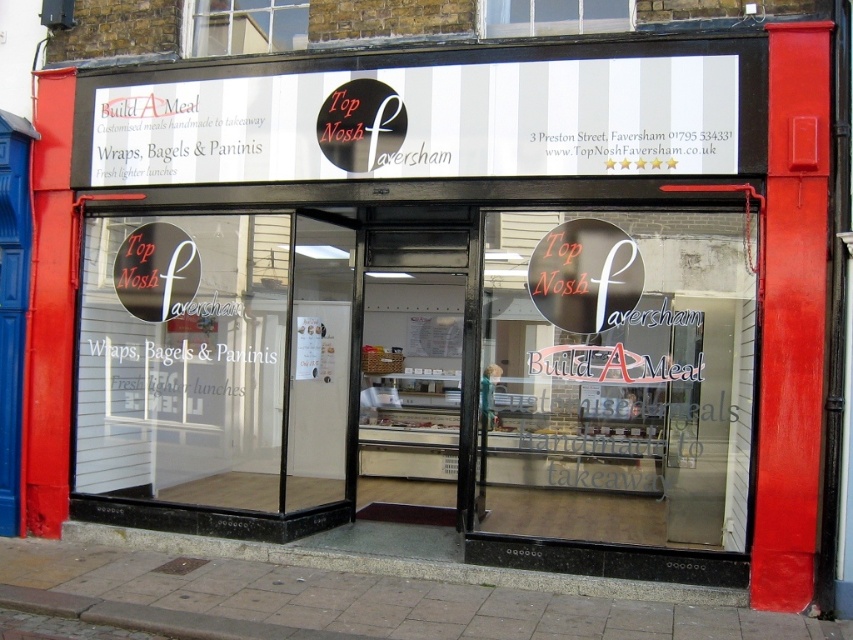
Does white striped sign at upper center have a greater height compared to white glass window at upper center?

Yes, white striped sign at upper center is taller than white glass window at upper center.

Where is `white striped sign at upper center`? The height and width of the screenshot is (640, 853). white striped sign at upper center is located at coordinates (424, 122).

Which is in front, point (630, 116) or point (585, 4)?

Point (630, 116)

This screenshot has width=853, height=640. Find the location of `white striped sign at upper center`. white striped sign at upper center is located at coordinates (424, 122).

Between transparent glass door at center and white striped sign at upper center, which one has more height?

transparent glass door at center

Is transparent glass door at center further to camera compared to white striped sign at upper center?

No, transparent glass door at center is closer to the viewer.

Does point (662, 397) come in front of point (578, 74)?

That is False.

The width and height of the screenshot is (853, 640). I want to click on transparent glass door at center, so click(x=616, y=376).

Who is positioned more to the left, transparent glass door at center or clear glass window at upper center?

clear glass window at upper center

Is point (582, 396) in front of point (280, 36)?

That is False.

Image resolution: width=853 pixels, height=640 pixels. I want to click on transparent glass door at center, so click(616, 376).